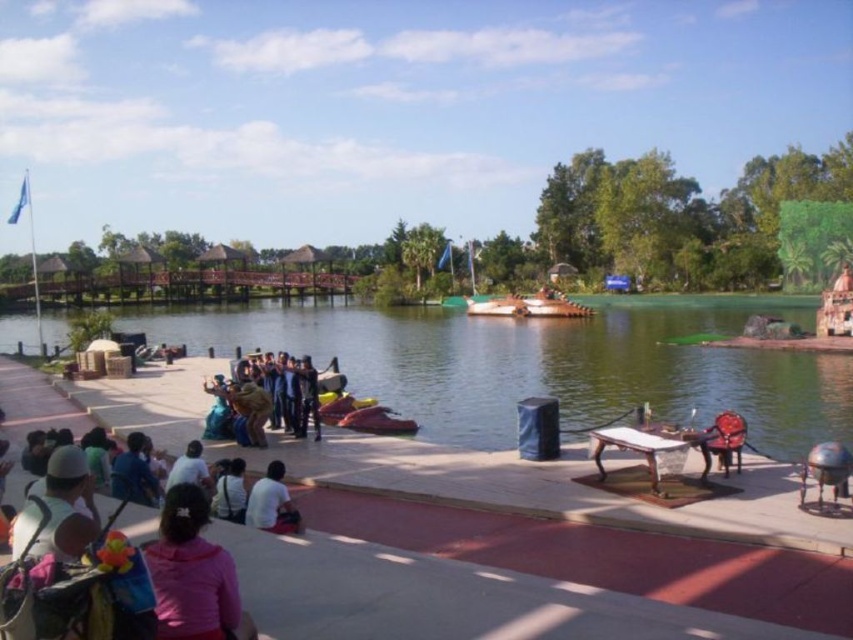
Is green water at stage left below wooden bridge at upper center?

Correct, green water at stage left is located below wooden bridge at upper center.

Is green water at stage left positioned in front of wooden bridge at upper center?

Yes, green water at stage left is in front of wooden bridge at upper center.

Is point (201, 416) less distant than point (352, 248)?

Yes, it is.

Locate an element on the screen. green water at stage left is located at coordinates (544, 364).

Is pink fabric crowd at lower left below white matte shirt at lower center?

Incorrect, pink fabric crowd at lower left is not positioned below white matte shirt at lower center.

Looking at this image, does pink fabric crowd at lower left appear over white matte shirt at lower center?

Yes, pink fabric crowd at lower left is above white matte shirt at lower center.

Is point (212, 586) positioned behind point (279, 516)?

No, it is in front of (279, 516).

Locate an element on the screen. This screenshot has height=640, width=853. pink fabric crowd at lower left is located at coordinates (189, 592).

Between wooden bridge at upper center and white matte shirt at lower center, which one is positioned lower?

white matte shirt at lower center is lower down.

Which of these two, wooden bridge at upper center or white matte shirt at lower center, stands shorter?

white matte shirt at lower center

Describe the element at coordinates (665, 220) in the screenshot. Image resolution: width=853 pixels, height=640 pixels. I see `wooden bridge at upper center` at that location.

Find the location of a particular element. wooden bridge at upper center is located at coordinates (665, 220).